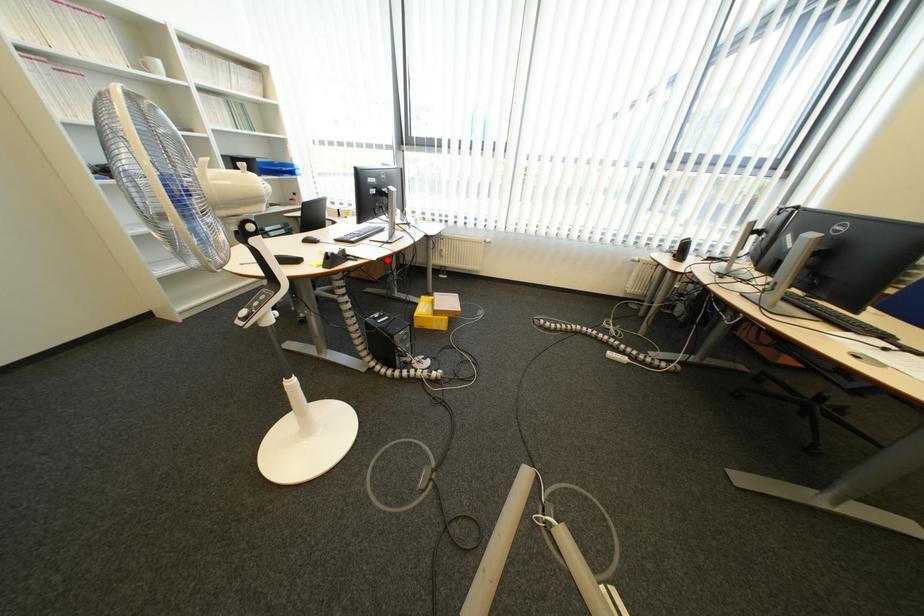
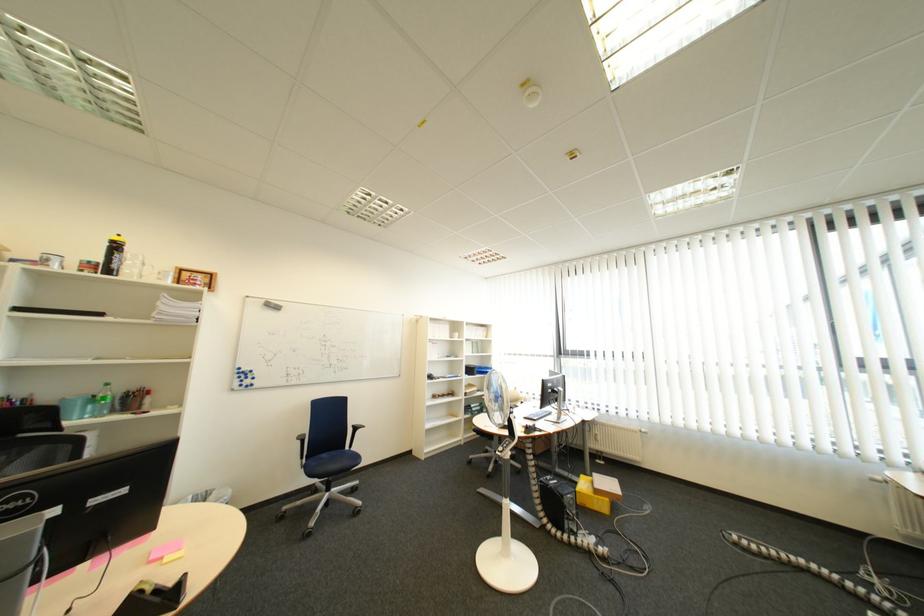
Question: I am providing you with two images of the same scene from different viewpoints. Given a red point in image1, look at the same physical point in image2. Is it:

Choices:
 (A) Closer to the viewpoint
 (B) Farther from the viewpoint

Answer: (B)